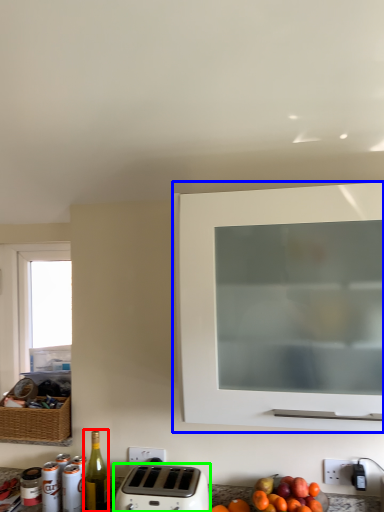
Question: Estimate the real-world distances between objects in this image. Which object is closer to bottle (highlighted by a red box), cabinetry (highlighted by a blue box) or toaster (highlighted by a green box)?

Choices:
 (A) cabinetry
 (B) toaster

Answer: (B)